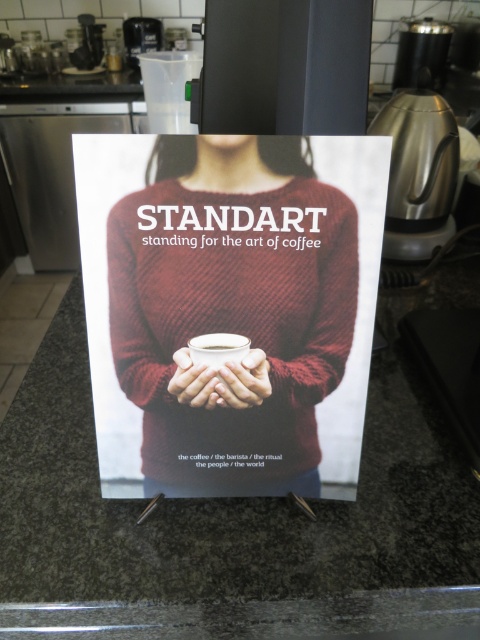
You are looking at the promotional poster on the countertop. There are two points marked on the poster at coordinates point (x=127, y=204) and point (x=190, y=403). Which point is closer to you?

Point (x=127, y=204) is in front of point (x=190, y=403), so the point (x=127, y=204) is closer to you.

What object is located at the coordinates point [240,381]?

The point [240,381] marks matte brown hands at center.